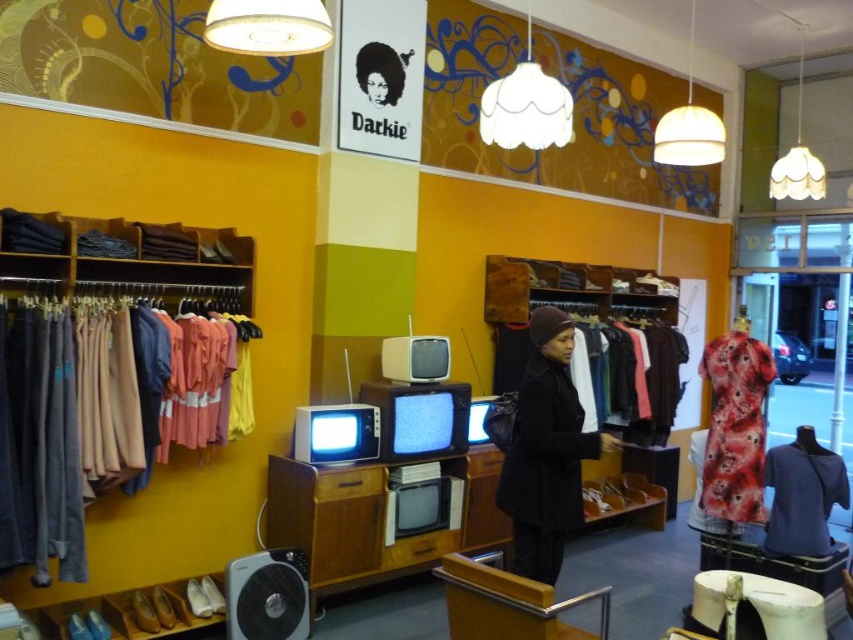
In the scene shown: You are a customer in the vintage store and want to try on both the black wool coat at center and the floral silk dress at right. Which item should you pick up first if you want to start with the one closer to the entrance?

The black wool coat at center is positioned on the left side of the floral silk dress at right, so it is closer to the entrance. You should pick up the black wool coat at center first.

You are standing in the middle of the vintage clothing store and want to find the soft cotton shirts at left. According to the store layout, where should you look relative to your current position?

The soft cotton shirts at left are located at the 2D coordinates point (57,429), which is to the left side of the store. Since you are in the middle, you should look towards the left side of the store to find them.

You are a customer in the store and want to know which clothing item takes up more space. Which one is larger between the soft cotton shirts at left and the black wool coat at center?

The soft cotton shirts at left is bigger than the black wool coat at center, so the soft cotton shirts at left takes up more space.